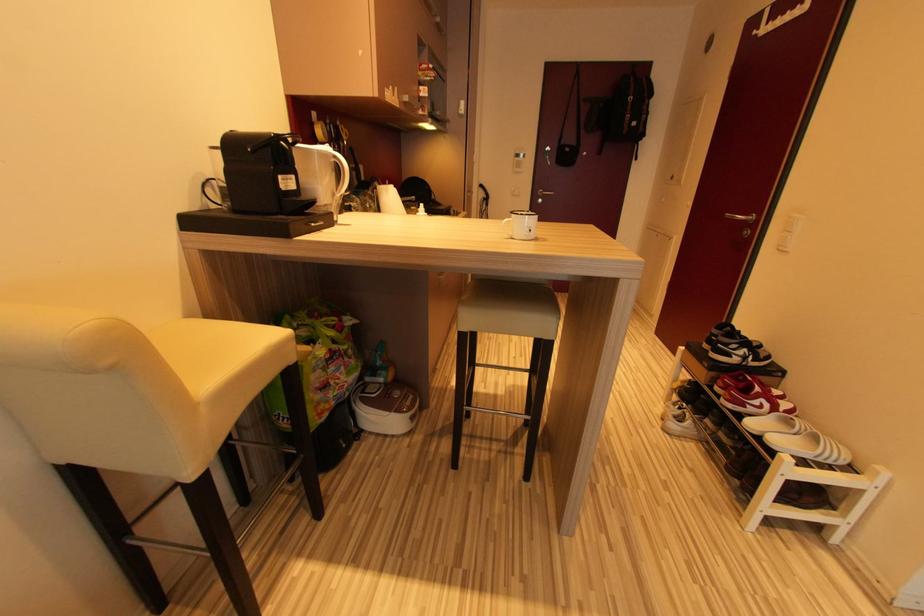
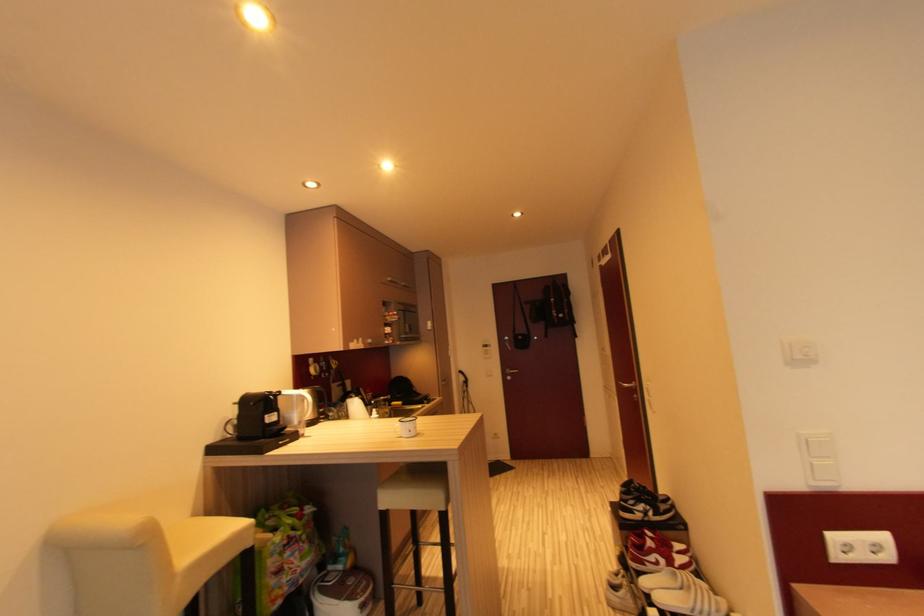
In a continuous first-person perspective shot, in which direction is the camera moving?

The cameraman walked toward right, backward.